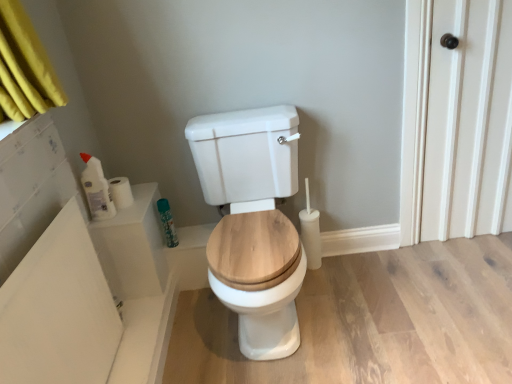
Question: Is white glossy toilet at center to the left of green matte spray can at upper left, arranged as the 1th toiletry when viewed from the right, from the viewer's perspective?

Choices:
 (A) no
 (B) yes

Answer: (A)

Question: Is white glossy toilet at center oriented away from green matte spray can at upper left, the 2th toiletry when ordered from front to back?

Choices:
 (A) yes
 (B) no

Answer: (B)

Question: Considering the relative positions of white glossy toilet at center and green matte spray can at upper left, the 2th toiletry when ordered from front to back, in the image provided, is white glossy toilet at center behind green matte spray can at upper left, the 2th toiletry when ordered from front to back,?

Choices:
 (A) yes
 (B) no

Answer: (B)

Question: Can you confirm if white glossy toilet at center is smaller than green matte spray can at upper left, arranged as the 1th toiletry when viewed from the right?

Choices:
 (A) no
 (B) yes

Answer: (A)

Question: Considering the relative sizes of white glossy toilet at center and green matte spray can at upper left, the 2th toiletry from the left, in the image provided, is white glossy toilet at center thinner than green matte spray can at upper left, the 2th toiletry from the left,?

Choices:
 (A) no
 (B) yes

Answer: (A)

Question: In the image, is white glossy toilet at center on the left side or the right side of white matte toilet paper at upper left?

Choices:
 (A) left
 (B) right

Answer: (B)

Question: From a real-world perspective, is white glossy toilet at center above or below white matte toilet paper at upper left?

Choices:
 (A) below
 (B) above

Answer: (A)

Question: Considering the positions of white glossy toilet at center and white matte toilet paper at upper left in the image, is white glossy toilet at center bigger or smaller than white matte toilet paper at upper left?

Choices:
 (A) big
 (B) small

Answer: (A)

Question: Is point (238, 299) positioned closer to the camera than point (125, 183)?

Choices:
 (A) closer
 (B) farther

Answer: (A)

Question: From a real-world perspective, is white glossy bottle at left, acting as the 1th toiletry starting from the left, positioned above or below white glossy bathtub at upper left?

Choices:
 (A) above
 (B) below

Answer: (A)

Question: In the image, is white glossy bottle at left, the 2th toiletry from the back, on the left side or the right side of white glossy bathtub at upper left?

Choices:
 (A) left
 (B) right

Answer: (A)

Question: Based on their sizes in the image, would you say white glossy bottle at left, acting as the 1th toiletry starting from the left, is bigger or smaller than white glossy bathtub at upper left?

Choices:
 (A) big
 (B) small

Answer: (B)

Question: Considering the positions of white glossy bottle at left, which is counted as the 1th toiletry, starting from the front, and white glossy bathtub at upper left in the image, is white glossy bottle at left, which is counted as the 1th toiletry, starting from the front, taller or shorter than white glossy bathtub at upper left?

Choices:
 (A) tall
 (B) short

Answer: (B)

Question: In terms of height, does white matte toilet paper at upper left look taller or shorter compared to white wood door at right?

Choices:
 (A) tall
 (B) short

Answer: (B)

Question: Based on their positions, is white matte toilet paper at upper left located to the left or right of white wood door at right?

Choices:
 (A) left
 (B) right

Answer: (A)